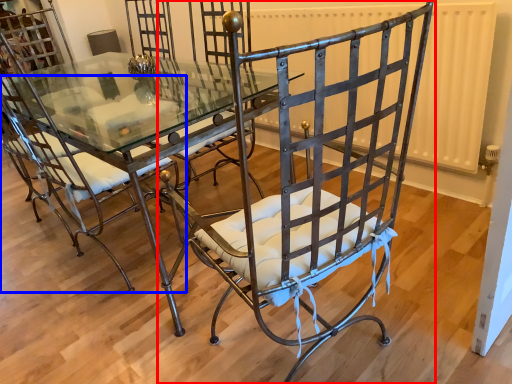
Question: Which point is further to the camera, chair (highlighted by a red box) or chair (highlighted by a blue box)?

Choices:
 (A) chair
 (B) chair

Answer: (B)